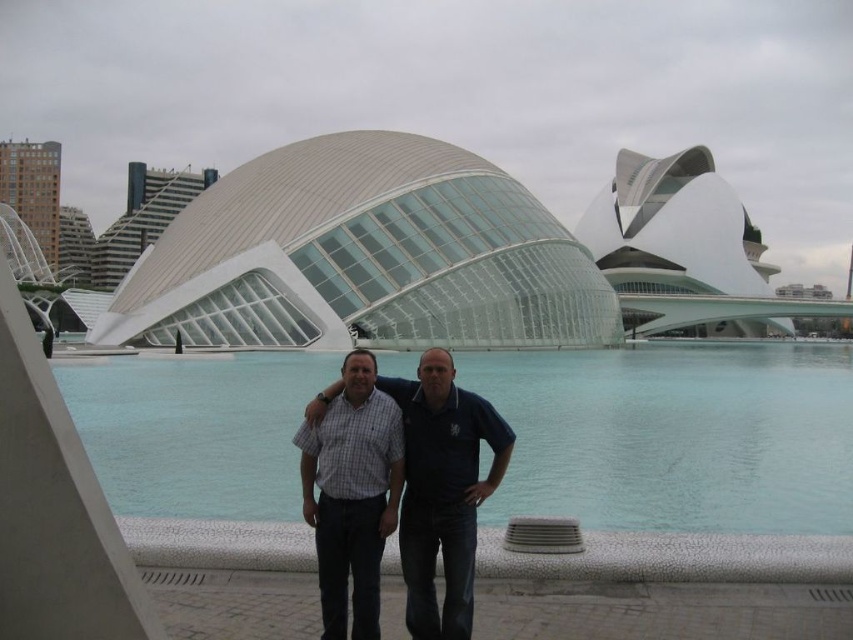
Question: Can you confirm if dark blue shirt at center is bigger than checkered fabric shirt at center?

Choices:
 (A) no
 (B) yes

Answer: (B)

Question: Which of the following is the farthest from the observer?

Choices:
 (A) dark blue shirt at center
 (B) transparent glass water at center
 (C) checkered fabric shirt at center

Answer: (B)

Question: Which is nearer to the checkered fabric shirt at center?

Choices:
 (A) dark blue shirt at center
 (B) transparent glass water at center

Answer: (A)

Question: Does transparent glass water at center appear over checkered fabric shirt at center?

Choices:
 (A) yes
 (B) no

Answer: (A)

Question: Which point is closer to the camera?

Choices:
 (A) (401, 570)
 (B) (323, 628)

Answer: (B)

Question: Is transparent glass water at center bigger than dark blue shirt at center?

Choices:
 (A) yes
 (B) no

Answer: (A)